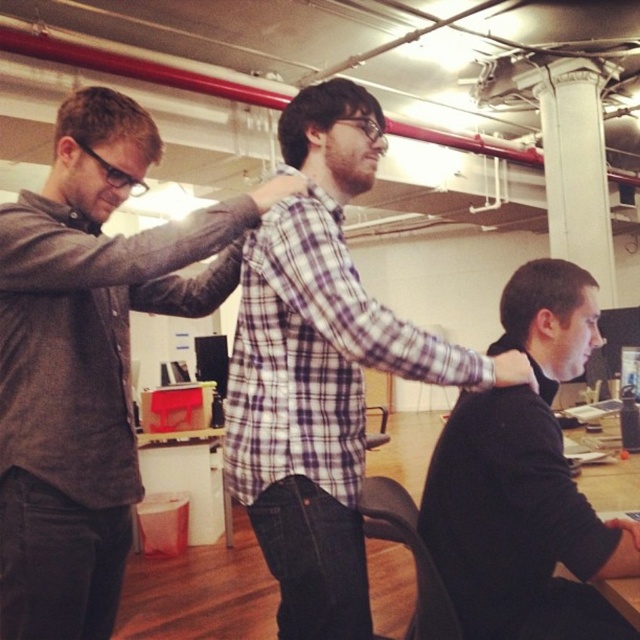
Question: Which object appears closest to the camera in this image?

Choices:
 (A) gray matte shirt at center
 (B) white smooth column at upper center
 (C) black sweater at center
 (D) plaid shirt at center

Answer: (C)

Question: Is gray matte shirt at center to the left of white smooth column at upper center from the viewer's perspective?

Choices:
 (A) yes
 (B) no

Answer: (A)

Question: Which of the following is the closest to the observer?

Choices:
 (A) black sweater at center
 (B) white smooth column at upper center
 (C) gray matte shirt at center
 (D) plaid shirt at center

Answer: (A)

Question: Which of the following is the closest to the observer?

Choices:
 (A) (349, 429)
 (B) (584, 84)
 (C) (10, 516)
 (D) (490, 404)

Answer: (C)

Question: Is plaid shirt at center smaller than black sweater at center?

Choices:
 (A) no
 (B) yes

Answer: (A)

Question: From the image, what is the correct spatial relationship of gray matte shirt at center in relation to white smooth column at upper center?

Choices:
 (A) left
 (B) right

Answer: (A)